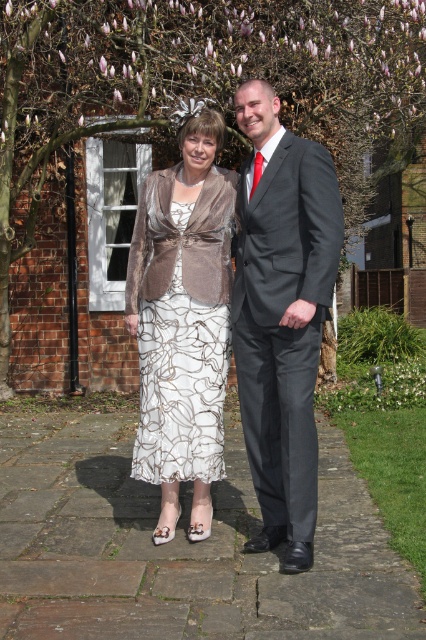
Question: Estimate the real-world distances between objects in this image. Which object is farther from the smooth bark tree at upper center?

Choices:
 (A) matte silver dress at center
 (B) dark gray suit at center

Answer: (B)

Question: Observing the image, what is the correct spatial positioning of smooth bark tree at upper center in reference to matte silver dress at center?

Choices:
 (A) right
 (B) left

Answer: (B)

Question: Which point is farther to the camera?

Choices:
 (A) matte silver dress at center
 (B) dark gray suit at center
 (C) smooth bark tree at upper center

Answer: (C)

Question: Where is smooth bark tree at upper center located in relation to dark gray suit at center in the image?

Choices:
 (A) below
 (B) above

Answer: (B)

Question: Which point is closer to the camera taking this photo?

Choices:
 (A) (175, 33)
 (B) (301, 161)

Answer: (B)

Question: Can you confirm if dark gray suit at center is positioned above matte silver dress at center?

Choices:
 (A) no
 (B) yes

Answer: (B)